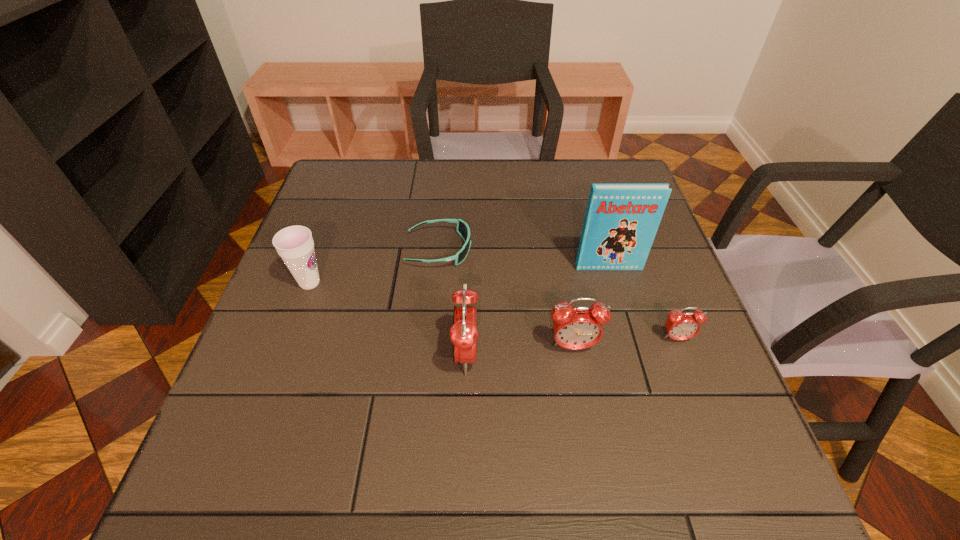
What are the coordinates of `empty location between the leftmost object and the tallest object` in the screenshot? It's located at (459, 275).

This screenshot has width=960, height=540. In order to click on free area in between the second shortest alarm clock and the sunglasses in this screenshot , I will do `click(506, 298)`.

The height and width of the screenshot is (540, 960). In order to click on vacant space that's between the leftmost object and the leftmost alarm clock in this screenshot , I will do `click(388, 319)`.

Locate an element on the screen. blank region between the tallest object and the second alarm clock from right to left is located at coordinates (590, 307).

The height and width of the screenshot is (540, 960). What are the coordinates of `free spot between the second shortest object and the leftmost object` in the screenshot? It's located at pos(493,310).

In order to click on blank region between the second shortest alarm clock and the cup in this screenshot , I will do `click(442, 315)`.

This screenshot has width=960, height=540. I want to click on blank region between the leftmost object and the shortest alarm clock, so click(493, 310).

This screenshot has width=960, height=540. Find the location of `free spot between the leftmost alarm clock and the second alarm clock from left to right`. free spot between the leftmost alarm clock and the second alarm clock from left to right is located at coordinates pyautogui.click(x=519, y=351).

The width and height of the screenshot is (960, 540). Find the location of `blank region between the second shortest object and the sunglasses`. blank region between the second shortest object and the sunglasses is located at coordinates (558, 294).

Identify the location of unoccupied position between the leftmost object and the second shortest object. (493, 310).